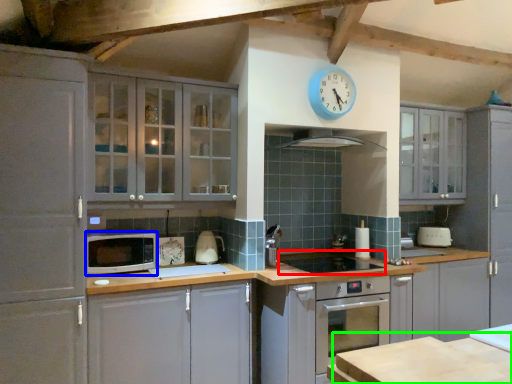
Question: Which object is positioned closest to appliance (highlighted by a red box)? Select from microwave oven (highlighted by a blue box) and table (highlighted by a green box).

Choices:
 (A) microwave oven
 (B) table

Answer: (A)